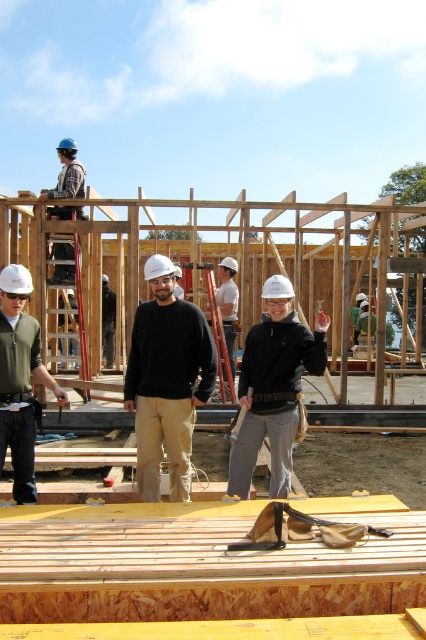
You are a construction worker standing at the origin point of the coordinate system. You need to place a new support beam exactly at the wooden frame at center. What are the coordinates where you should position the beam?

The coordinates for the wooden frame at center are at point (201, 561). Position the support beam there.

You are a construction worker standing at the edge of the platform. You need to retrieve the matte black jacket at center, which is currently on the wooden surface. If you can reach 2 meters, can you grab it without moving from your spot?

The matte black jacket at center and camera are 4.44 meters apart. Since you can only reach 2 meters, you cannot grab the matte black jacket at center from your current position.

In the scene shown: You are a construction worker standing at point (39,406). You need to reach a tool bag placed 4.45 meters away from you. Is the distance sufficient to safely throw a tool to the tool bag from your current position?

The distance between you and the tool bag is 4.45 meters. Whether you can safely throw the tool depends on your throwing accuracy and the tool bag size. However, the description only provides the distance, so we can confirm the distance is 4.45 meters.